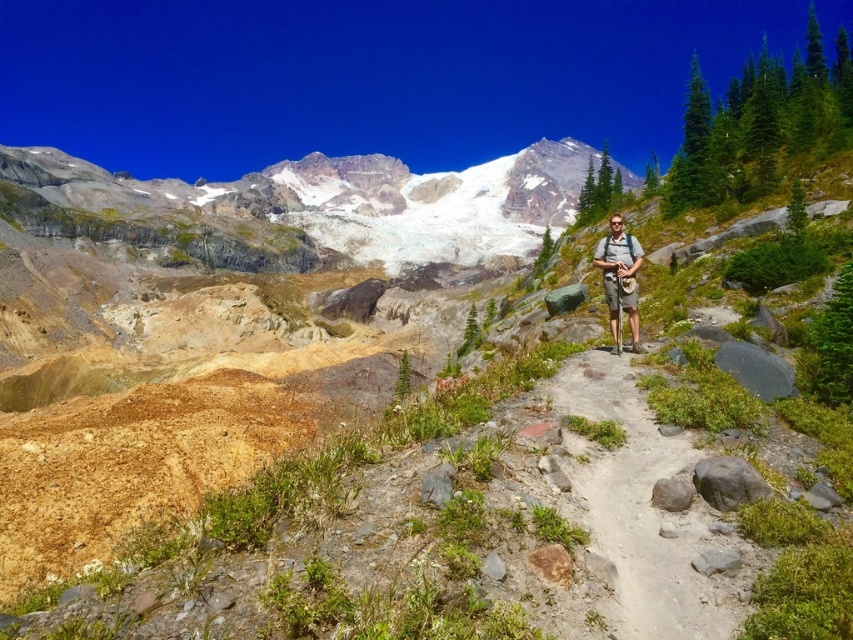
Is dirt/gravel path at center above gray fabric backpack at center?

No.

Does dirt/gravel path at center lie in front of gray fabric backpack at center?

Yes, dirt/gravel path at center is closer to the viewer.

Where is `dirt/gravel path at center`? dirt/gravel path at center is located at coordinates (647, 512).

Where is `dirt/gravel path at center`? The height and width of the screenshot is (640, 853). dirt/gravel path at center is located at coordinates (647, 512).